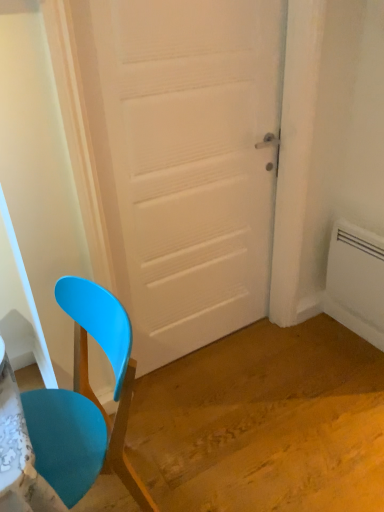
Identify the location of free point to the right of matte plastic chair at left. This screenshot has height=512, width=384. (210, 465).